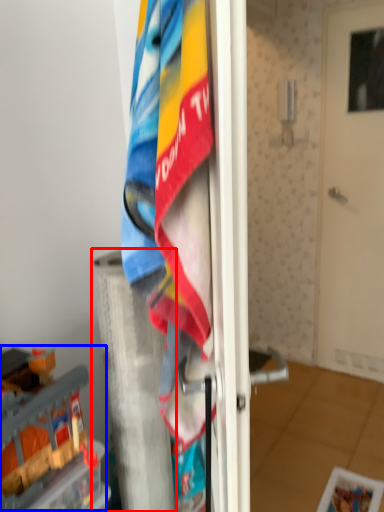
Question: Which object appears closest to the camera in this image, pillar (highlighted by a red box) or toy (highlighted by a blue box)?

Choices:
 (A) pillar
 (B) toy

Answer: (B)